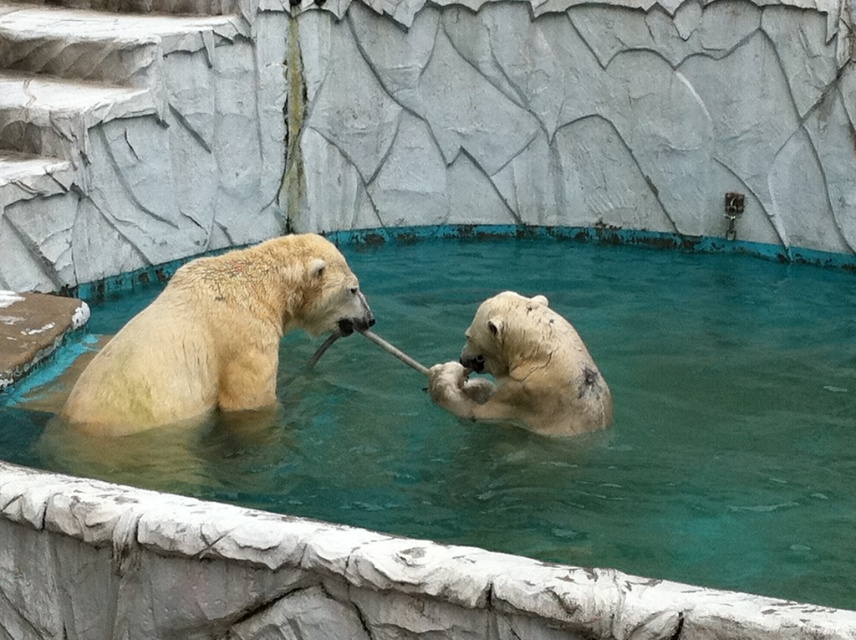
Question: Does clear blue water at center appear on the left side of white fur paw at center?

Choices:
 (A) no
 (B) yes

Answer: (A)

Question: Is white fur bear at left bigger than white fur bear at center?

Choices:
 (A) yes
 (B) no

Answer: (A)

Question: Is clear blue water at center positioned in front of white fur bear at left?

Choices:
 (A) yes
 (B) no

Answer: (A)

Question: Among these objects, which one is farthest from the camera?

Choices:
 (A) white fur paw at center
 (B) white fur bear at left

Answer: (A)

Question: Considering the real-world distances, which object is closest to the white fur paw at center?

Choices:
 (A) white fur bear at left
 (B) white fur bear at center

Answer: (B)

Question: Which is nearer to the white fur paw at center?

Choices:
 (A) white fur bear at left
 (B) white fur bear at center

Answer: (B)